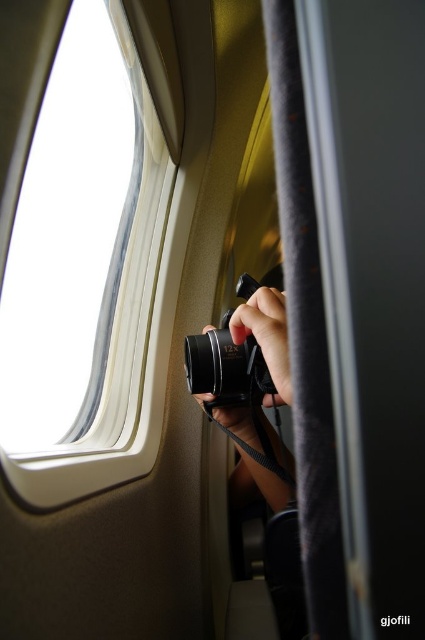
Question: Does white plastic airplane window at upper left appear under matte black camera at center?

Choices:
 (A) yes
 (B) no

Answer: (B)

Question: Does white plastic airplane window at upper left appear under matte black camera at center?

Choices:
 (A) no
 (B) yes

Answer: (A)

Question: Which object is closer to the camera taking this photo?

Choices:
 (A) white plastic airplane window at upper left
 (B) matte black camera at center

Answer: (A)

Question: Which point is farther from the camera taking this photo?

Choices:
 (A) (289, 380)
 (B) (34, 474)

Answer: (B)

Question: Does white plastic airplane window at upper left appear over matte black camera at center?

Choices:
 (A) no
 (B) yes

Answer: (B)